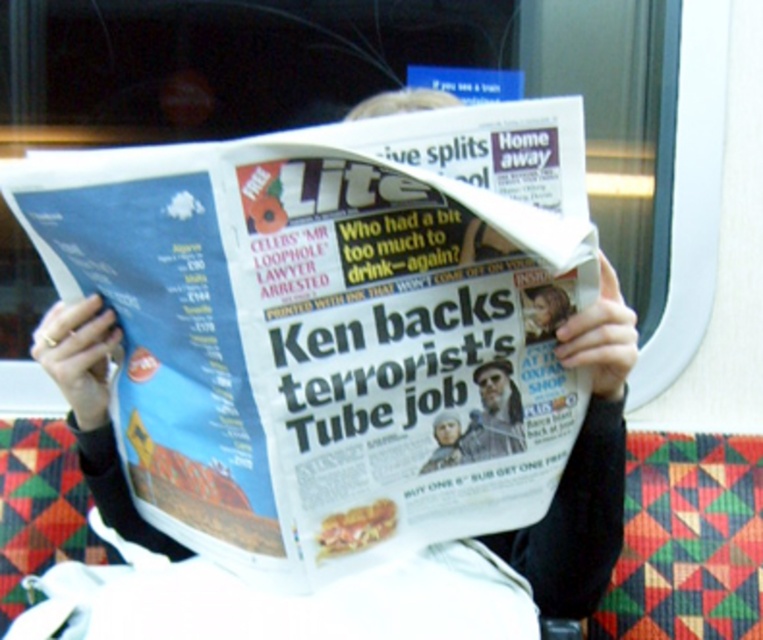
Question: Is white glossy newspaper at center closer to camera compared to gray beard at center?

Choices:
 (A) no
 (B) yes

Answer: (B)

Question: Among these points, which one is farthest from the camera?

Choices:
 (A) (147, 260)
 (B) (480, 426)

Answer: (B)

Question: Considering the relative positions of white glossy newspaper at center and gray beard at center in the image provided, where is white glossy newspaper at center located with respect to gray beard at center?

Choices:
 (A) right
 (B) left

Answer: (B)

Question: Considering the relative positions of white glossy newspaper at center and gray beard at center in the image provided, where is white glossy newspaper at center located with respect to gray beard at center?

Choices:
 (A) right
 (B) left

Answer: (B)